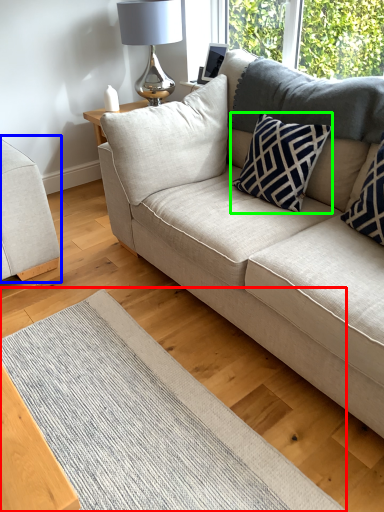
Question: Which is farther away from mat (highlighted by a red box)? studio couch (highlighted by a blue box) or pillow (highlighted by a green box)?

Choices:
 (A) studio couch
 (B) pillow

Answer: (B)